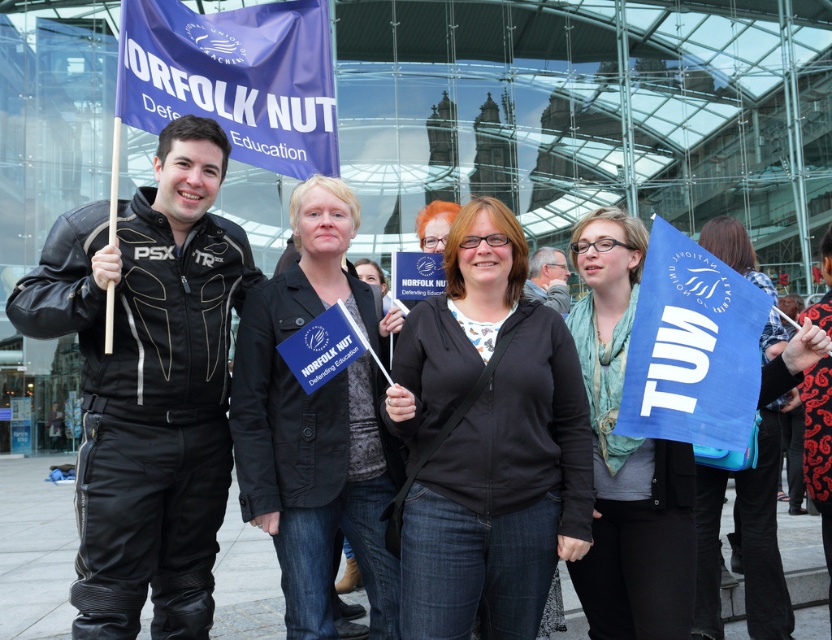
You are a photographer adjusting your camera settings to capture the reflection of the modern glass building in the matte blue flag at center. Since the black leather jacket at center is blocking part of the flag, will you need to move the flag upwards or downwards to avoid the jacket?

The black leather jacket at center is below the matte blue flag at center. To avoid the jacket, you should move the matte blue flag at center downwards so it is positioned above the jacket, ensuring the reflection of the building can be captured without obstruction.

You are a photographer trying to capture a clear shot of both the black fabric jacket at center and the black leather jacket at center. Since they are both at the center, how can you distinguish which jacket is closer to you?

The black fabric jacket at center is located above the black leather jacket at center, so the one appearing higher in the frame is closer to you.